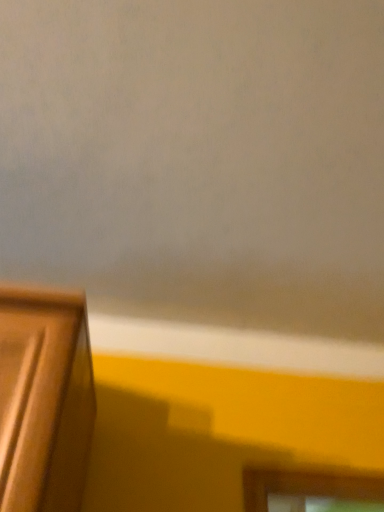
The width and height of the screenshot is (384, 512). Describe the element at coordinates (307, 486) in the screenshot. I see `wooden frame at lower right` at that location.

Identify the location of wooden frame at lower right. (307, 486).

The height and width of the screenshot is (512, 384). I want to click on wooden frame at lower right, so click(x=307, y=486).